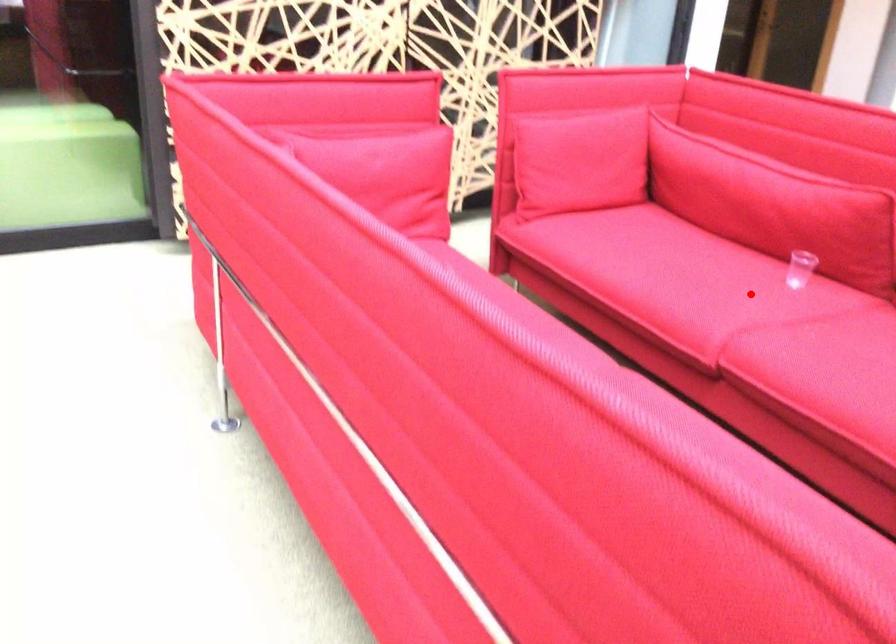
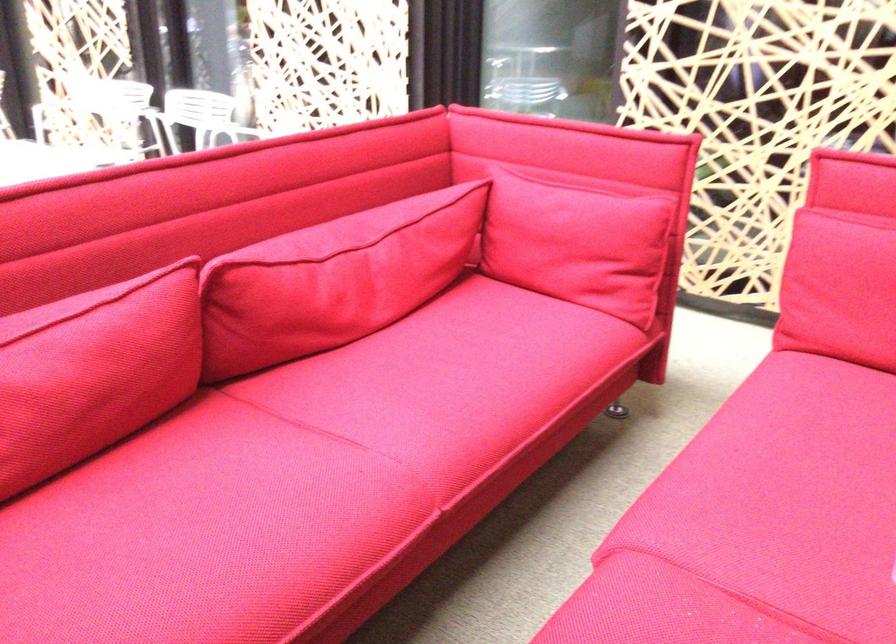
Find the pixel in the second image that matches the highlighted location in the first image.

(759, 522)